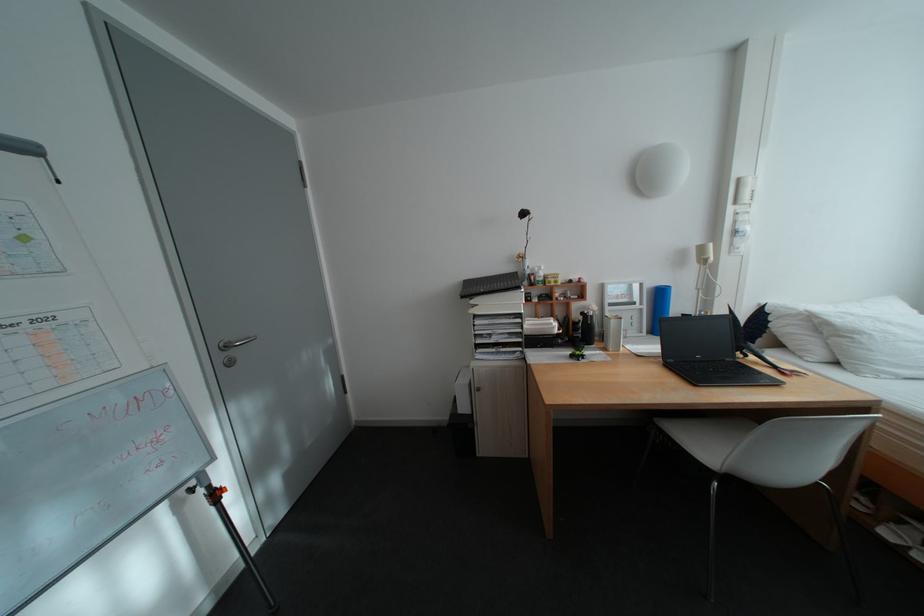
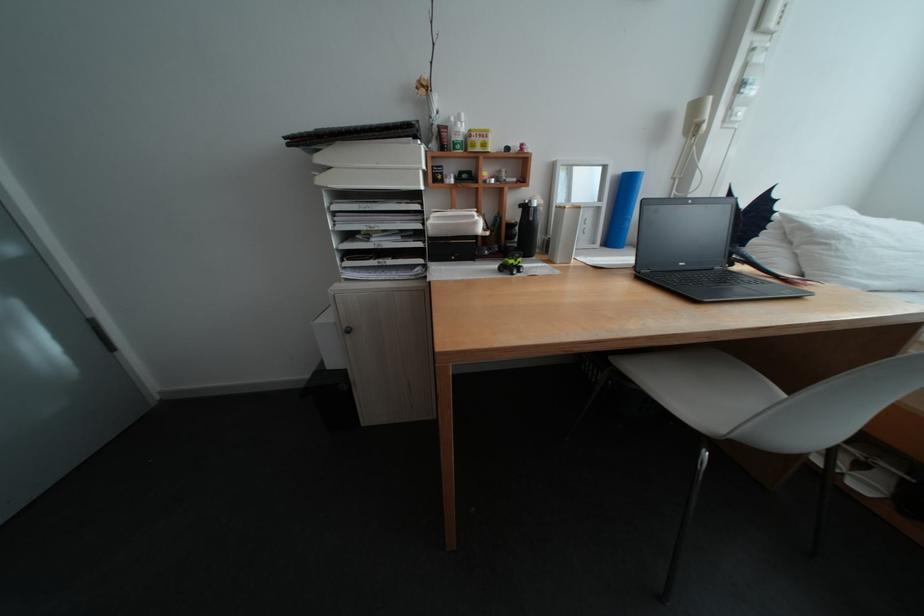
The point at (x=541, y=276) is marked in the first image. Where is the corresponding point in the second image?

(453, 128)